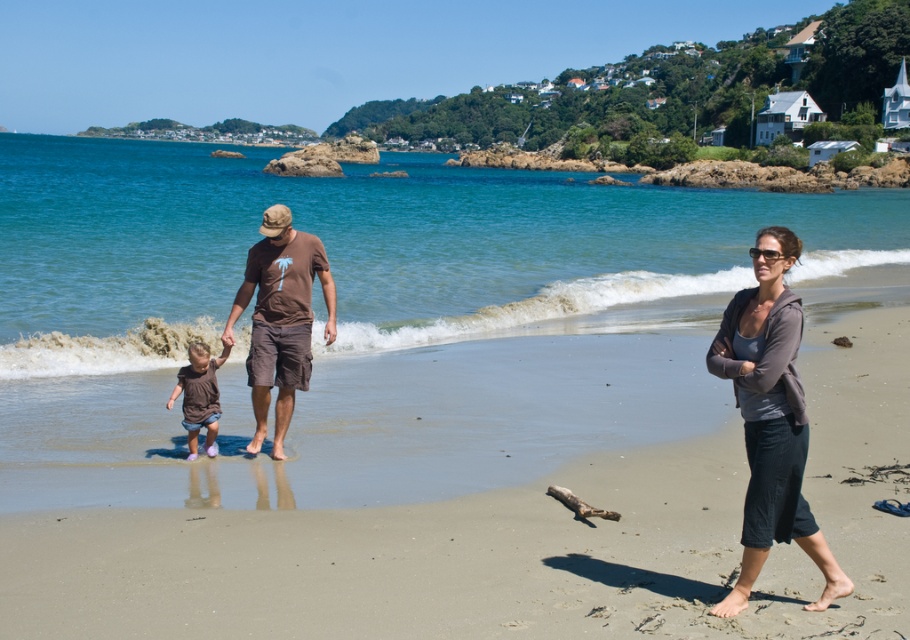
Is brown cotton t-shirt at center shorter than matte brown shorts at center?

Yes, brown cotton t-shirt at center is shorter than matte brown shorts at center.

Does point (270, 269) come in front of point (207, 376)?

That is False.

Is point (256, 435) farther from viewer compared to point (193, 433)?

Yes, point (256, 435) is farther from viewer.

Locate an element on the screen. The height and width of the screenshot is (640, 910). brown cotton t-shirt at center is located at coordinates (280, 317).

Which is behind, point (229, 577) or point (777, 484)?

Point (229, 577)

Between smooth sand at center and gray fleece jacket at right, which one appears on the right side from the viewer's perspective?

smooth sand at center is more to the right.

Which is behind, point (757, 627) or point (751, 531)?

The point (751, 531) is behind.

Where is `smooth sand at center`? This screenshot has width=910, height=640. smooth sand at center is located at coordinates (509, 541).

In the scene shown: Between smooth sand at center and brown cotton t-shirt at center, which one has more height?

Standing taller between the two is smooth sand at center.

Is point (474, 508) farther from viewer compared to point (274, 353)?

No, (474, 508) is in front of (274, 353).

The height and width of the screenshot is (640, 910). Find the location of `smooth sand at center`. smooth sand at center is located at coordinates (509, 541).